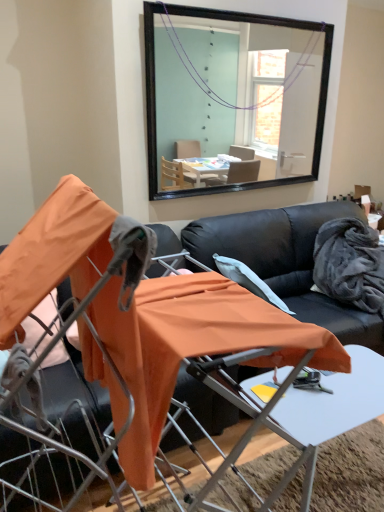
Question: Considering the positions of black leather couch at center and orange fabric chair at center, the first chair when ordered from right to left, in the image, is black leather couch at center taller or shorter than orange fabric chair at center, the first chair when ordered from right to left,?

Choices:
 (A) tall
 (B) short

Answer: (B)

Question: In terms of size, does black leather couch at center appear bigger or smaller than orange fabric chair at center, the first chair when ordered from right to left?

Choices:
 (A) big
 (B) small

Answer: (A)

Question: Based on their relative distances, which object is nearer to the velvety gray blanket at right?

Choices:
 (A) black leather couch at center
 (B) orange fabric table at center
 (C) orange fabric chair at center, the first chair when ordered from right to left
 (D) orange fabric chair at center, marked as the second chair in a right-to-left arrangement

Answer: (A)

Question: Based on their relative distances, which object is nearer to the orange fabric chair at center, the first chair when ordered from right to left?

Choices:
 (A) orange fabric chair at center, the 1th chair when ordered from left to right
 (B) velvety gray blanket at right
 (C) orange fabric table at center
 (D) black leather couch at center

Answer: (A)